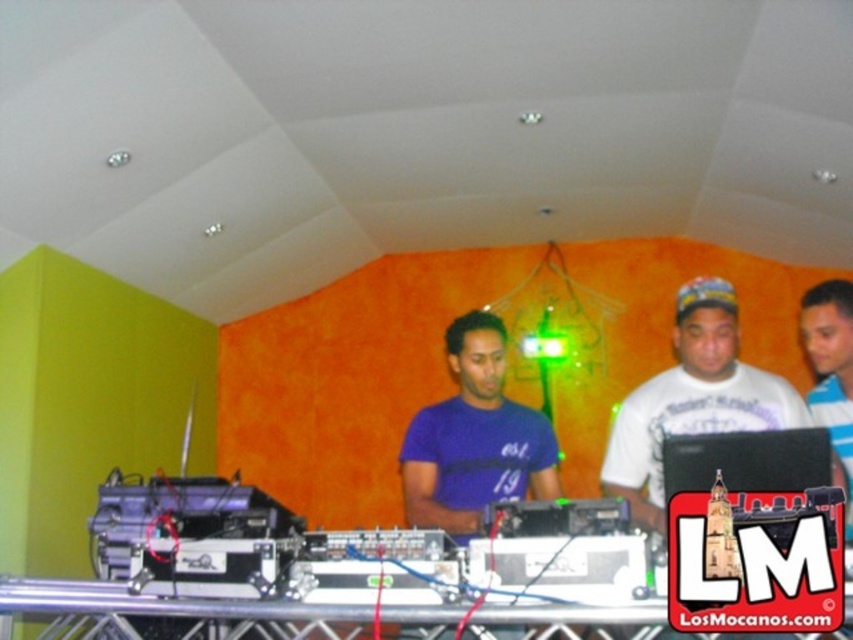
You are a technician who needs to connect a cable from the black plastic laptop at center to the white striped shirt at center. The cable you have is 50 centimeters long. Will it reach?

The black plastic laptop at center is 49.74 centimeters from the white striped shirt at center. Since the cable is 50 centimeters long, it will reach comfortably.